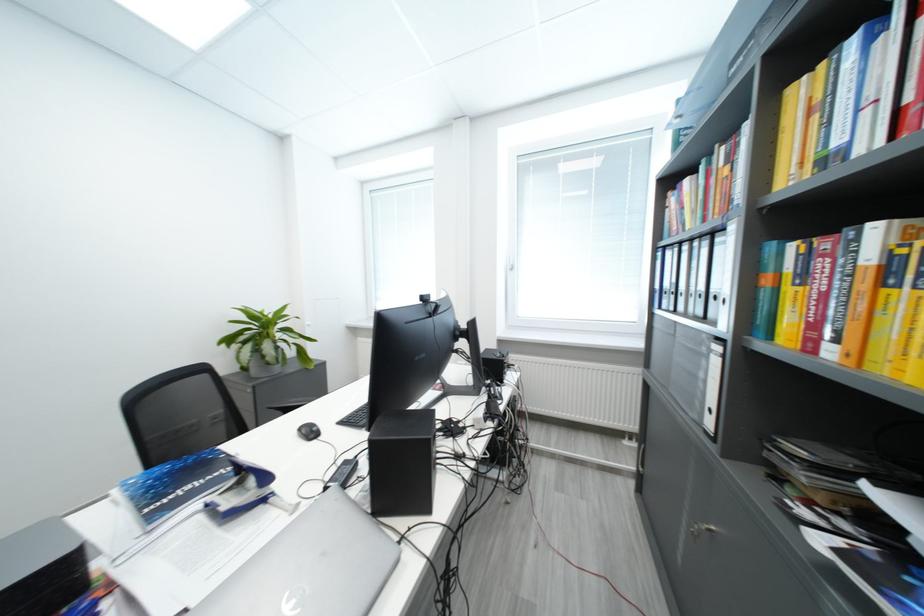
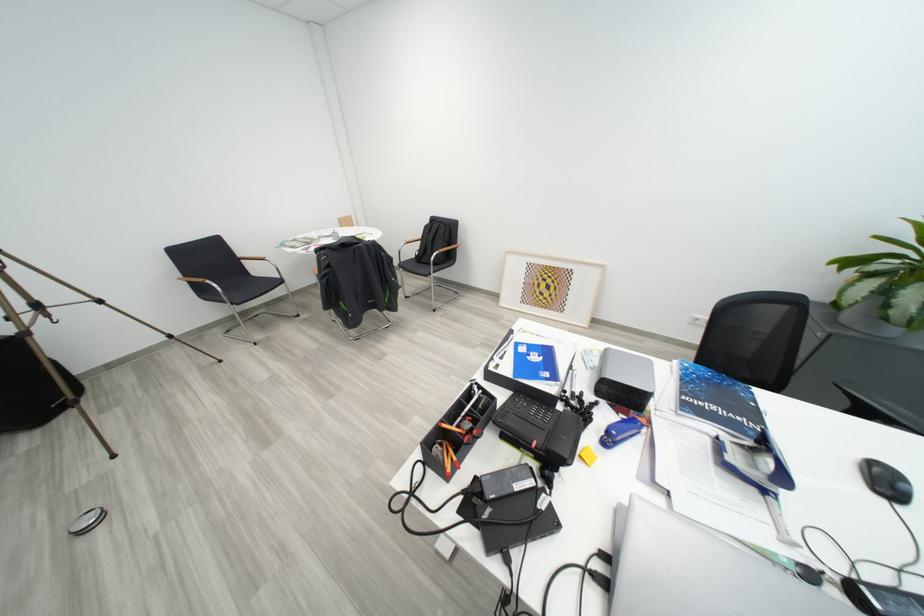
In the second image, find the point that corresponds to the point at 319,435 in the first image.

(895, 485)